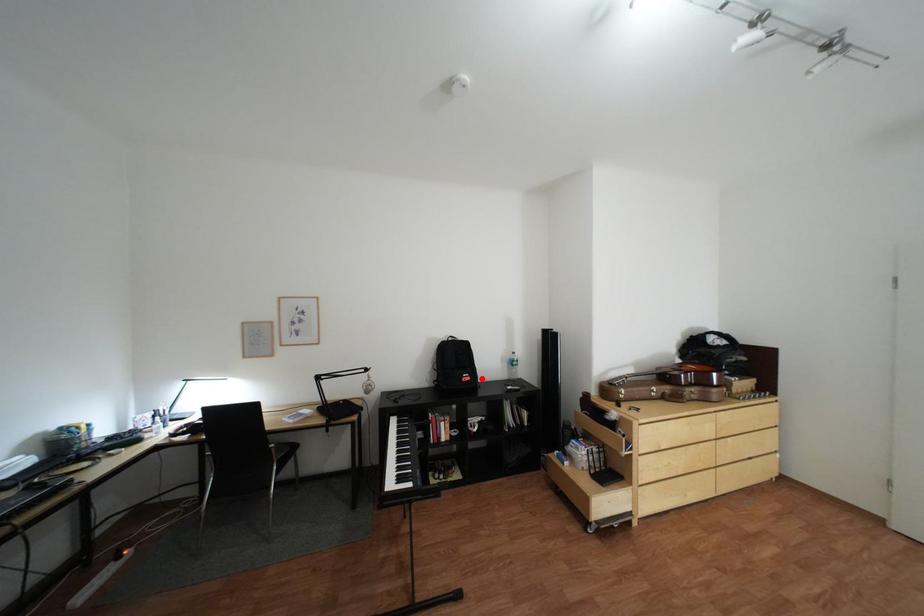
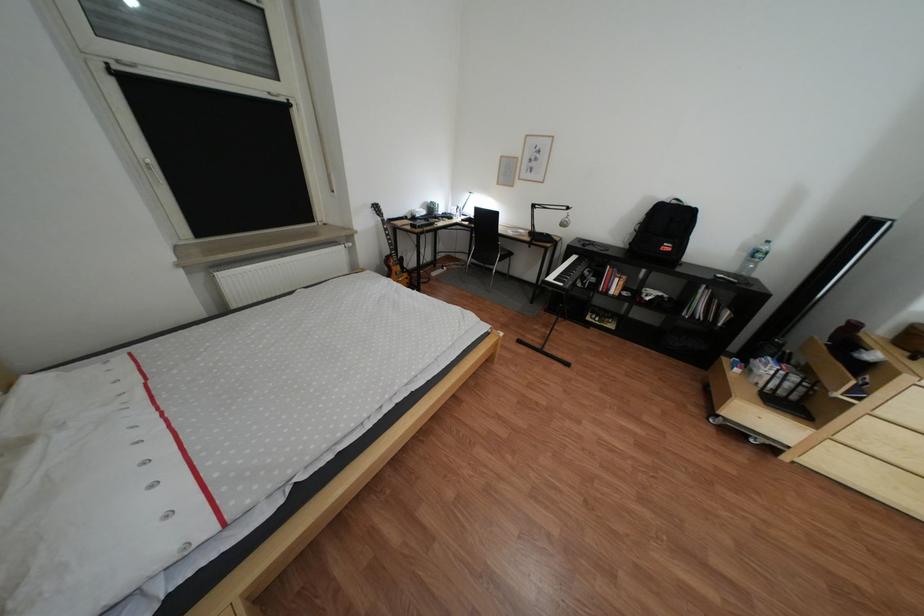
Find the pixel in the second image that matches the highlighted location in the first image.

(683, 248)